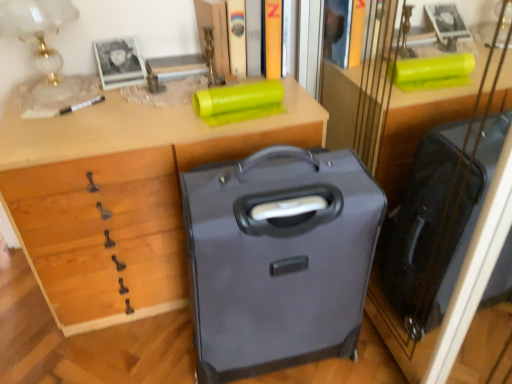
What do you see at coordinates (279, 260) in the screenshot?
I see `matte gray suitcase at center` at bounding box center [279, 260].

At what (x,y) coordinates should I click in order to perform the action: click on matte wood desk at center. Please return your answer as a coordinate pair (x, y). The width and height of the screenshot is (512, 384). Looking at the image, I should click on (121, 197).

You are a GUI agent. You are given a task and a screenshot of the screen. Output one action in this format:
    pyautogui.click(x=<x>, y=<y>)
    Task: Click on the matte gray suitcase at center
    The image size is (512, 384).
    Given the screenshot: What is the action you would take?
    [x=279, y=260]

Between point (223, 200) and point (49, 79), which one is positioned behind?

The point (49, 79) is farther.

Considering the sizes of objects matte gray suitcase at center and matte glass table lamp at upper left in the image provided, who is bigger, matte gray suitcase at center or matte glass table lamp at upper left?

With larger size is matte gray suitcase at center.

Which object is positioned more to the right, matte gray suitcase at center or matte glass table lamp at upper left?

matte gray suitcase at center is more to the right.

From a real-world perspective, is matte gray suitcase at center over matte glass table lamp at upper left?

Incorrect, from a real-world perspective, matte gray suitcase at center is lower than matte glass table lamp at upper left.

From the image's perspective, is matte glass table lamp at upper left located above or below hardcover book at upper center, which is the 1th book from right to left?

matte glass table lamp at upper left is situated lower than hardcover book at upper center, which is the 1th book from right to left, in the image.

Is matte glass table lamp at upper left located outside hardcover book at upper center, which is the 1th book from right to left?

That's correct, matte glass table lamp at upper left is outside of hardcover book at upper center, which is the 1th book from right to left.

Is matte glass table lamp at upper left positioned behind hardcover book at upper center, arranged as the second book when viewed from the left?

No, the depth of matte glass table lamp at upper left is less than that of hardcover book at upper center, arranged as the second book when viewed from the left.

Can you see matte glass table lamp at upper left touching hardcover book at upper center, arranged as the second book when viewed from the left?

No, matte glass table lamp at upper left is not making contact with hardcover book at upper center, arranged as the second book when viewed from the left.

Is matte plastic book at upper center, positioned as the first book in left-to-right order, inside or outside of hardcover book at upper center, which is the 1th book from right to left?

matte plastic book at upper center, positioned as the first book in left-to-right order, exists outside the volume of hardcover book at upper center, which is the 1th book from right to left.

What's the angular difference between matte plastic book at upper center, positioned as the first book in left-to-right order, and hardcover book at upper center, which is the 1th book from right to left,'s facing directions?

They differ by 4.49 degrees in their facing directions.

Considering the relative sizes of matte plastic book at upper center, the 2th book from the right, and hardcover book at upper center, which is the 1th book from right to left, in the image provided, is matte plastic book at upper center, the 2th book from the right, smaller than hardcover book at upper center, which is the 1th book from right to left,?

No, matte plastic book at upper center, the 2th book from the right, is not smaller than hardcover book at upper center, which is the 1th book from right to left.

From the picture: Which object is thinner, matte plastic book at upper center, the 2th book from the right, or hardcover book at upper center, arranged as the second book when viewed from the left?

Thinner between the two is matte plastic book at upper center, the 2th book from the right.

Based on the photo, who is more distant, matte gray suitcase at center or matte wood desk at center?

matte wood desk at center.

From the image's perspective, which object appears higher, matte gray suitcase at center or matte wood desk at center?

matte wood desk at center is shown above in the image.

At what (x,y) coordinates should I click in order to perform the action: click on desk that appears behind the matte gray suitcase at center. Please return your answer as a coordinate pair (x, y). Image resolution: width=512 pixels, height=384 pixels. Looking at the image, I should click on (121, 197).

Is point (313, 301) positioned in front of point (152, 125)?

Yes, it is.

Would you say matte gray suitcase at center is a long distance from hardcover book at upper center, which is the 1th book from right to left?

They are positioned close to each other.

The image size is (512, 384). I want to click on suitcase on the left side of hardcover book at upper center, which is the 1th book from right to left, so click(279, 260).

Which of these two, matte gray suitcase at center or hardcover book at upper center, arranged as the second book when viewed from the left, is bigger?

With larger size is matte gray suitcase at center.

Is the position of matte gray suitcase at center less distant than that of hardcover book at upper center, arranged as the second book when viewed from the left?

Yes, the depth of matte gray suitcase at center is less than that of hardcover book at upper center, arranged as the second book when viewed from the left.

From a real-world perspective, between matte glass table lamp at upper left and matte gray suitcase at center, who is vertically lower?

matte gray suitcase at center, from a real-world perspective.

Is matte glass table lamp at upper left turned away from matte gray suitcase at center?

No, matte gray suitcase at center is not at the back of matte glass table lamp at upper left.

Can you confirm if matte glass table lamp at upper left is shorter than matte gray suitcase at center?

Indeed, matte glass table lamp at upper left has a lesser height compared to matte gray suitcase at center.

Considering the sizes of hardcover book at upper center, arranged as the second book when viewed from the left, and matte plastic book at upper center, the 2th book from the right, in the image, is hardcover book at upper center, arranged as the second book when viewed from the left, wider or thinner than matte plastic book at upper center, the 2th book from the right,?

Considering their sizes, hardcover book at upper center, arranged as the second book when viewed from the left, looks broader than matte plastic book at upper center, the 2th book from the right.

What's the angular difference between hardcover book at upper center, which is the 1th book from right to left, and matte plastic book at upper center, the 2th book from the right,'s facing directions?

4.49 degrees separate the facing orientations of hardcover book at upper center, which is the 1th book from right to left, and matte plastic book at upper center, the 2th book from the right.

Does point (279, 11) appear closer or farther from the camera than point (231, 14)?

Point (279, 11) is positioned closer to the camera compared to point (231, 14).

Can you confirm if hardcover book at upper center, which is the 1th book from right to left, is taller than matte plastic book at upper center, positioned as the first book in left-to-right order?

Yes.

The width and height of the screenshot is (512, 384). Find the location of `suitcase that is in front of the matte glass table lamp at upper left`. suitcase that is in front of the matte glass table lamp at upper left is located at coordinates (279, 260).

Locate an element on the screen. This screenshot has width=512, height=384. table lamp below the hardcover book at upper center, which is the 1th book from right to left (from the image's perspective) is located at coordinates (38, 29).

Estimate the real-world distances between objects in this image. Which object is further from matte wood desk at center, matte plastic book at upper center, positioned as the first book in left-to-right order, or matte glass table lamp at upper left?

matte plastic book at upper center, positioned as the first book in left-to-right order, is positioned further to the anchor matte wood desk at center.

When comparing their distances from matte glass table lamp at upper left, does matte plastic book at upper center, positioned as the first book in left-to-right order, or matte gray suitcase at center seem further?

matte gray suitcase at center lies further to matte glass table lamp at upper left than the other object.

When comparing their distances from matte glass table lamp at upper left, does matte wood desk at center or matte plastic book at upper center, the 2th book from the right, seem closer?

Among the two, matte wood desk at center is located nearer to matte glass table lamp at upper left.

When comparing their distances from matte wood desk at center, does hardcover book at upper center, which is the 1th book from right to left, or matte gray suitcase at center seem further?

The object further to matte wood desk at center is hardcover book at upper center, which is the 1th book from right to left.

Which object lies nearer to the anchor point hardcover book at upper center, arranged as the second book when viewed from the left, matte wood desk at center or matte plastic book at upper center, positioned as the first book in left-to-right order?

matte plastic book at upper center, positioned as the first book in left-to-right order, is positioned closer to the anchor hardcover book at upper center, arranged as the second book when viewed from the left.

When comparing their distances from matte plastic book at upper center, positioned as the first book in left-to-right order, does matte gray suitcase at center or matte wood desk at center seem further?

The object further to matte plastic book at upper center, positioned as the first book in left-to-right order, is matte gray suitcase at center.

Which object lies further to the anchor point matte glass table lamp at upper left, matte wood desk at center or matte gray suitcase at center?

matte gray suitcase at center.

From the image, which object appears to be farther from matte glass table lamp at upper left, matte gray suitcase at center or hardcover book at upper center, arranged as the second book when viewed from the left?

Based on the image, matte gray suitcase at center appears to be further to matte glass table lamp at upper left.

Find the location of a particular element. table lamp between matte plastic book at upper center, positioned as the first book in left-to-right order, and matte wood desk at center in the up-down direction is located at coordinates (38, 29).

The width and height of the screenshot is (512, 384). What are the coordinates of `book between matte glass table lamp at upper left and hardcover book at upper center, arranged as the second book when viewed from the left, in the horizontal direction` in the screenshot? It's located at (237, 37).

Where is `table lamp between hardcover book at upper center, which is the 1th book from right to left, and matte gray suitcase at center from top to bottom`? Image resolution: width=512 pixels, height=384 pixels. table lamp between hardcover book at upper center, which is the 1th book from right to left, and matte gray suitcase at center from top to bottom is located at coordinates (38, 29).

This screenshot has height=384, width=512. I want to click on desk that lies between matte plastic book at upper center, positioned as the first book in left-to-right order, and matte gray suitcase at center from top to bottom, so click(x=121, y=197).